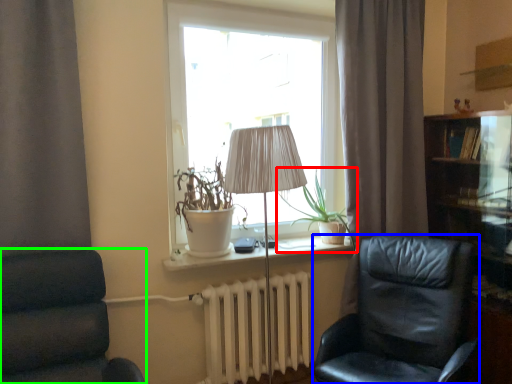
Question: Which is farther away from plant (highlighted by a red box)? chair (highlighted by a blue box) or chair (highlighted by a green box)?

Choices:
 (A) chair
 (B) chair

Answer: (B)